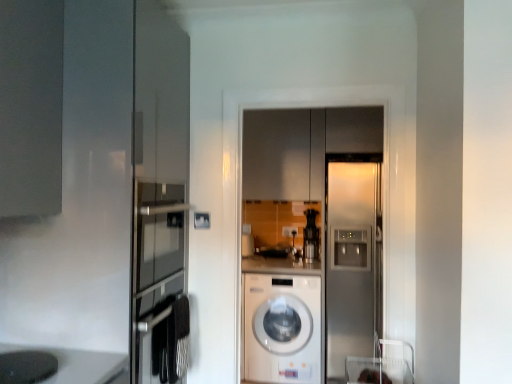
Question: Would you say black plastic coffee machine at center is outside matte gray cabinet at center?

Choices:
 (A) no
 (B) yes

Answer: (B)

Question: Would you say black plastic coffee machine at center contains matte gray cabinet at center?

Choices:
 (A) no
 (B) yes

Answer: (A)

Question: From a real-world perspective, is black plastic coffee machine at center below matte gray cabinet at center?

Choices:
 (A) no
 (B) yes

Answer: (B)

Question: Is black plastic coffee machine at center to the left of matte gray cabinet at center from the viewer's perspective?

Choices:
 (A) yes
 (B) no

Answer: (B)

Question: Considering the relative sizes of black plastic coffee machine at center and matte gray cabinet at center in the image provided, is black plastic coffee machine at center bigger than matte gray cabinet at center?

Choices:
 (A) yes
 (B) no

Answer: (B)

Question: From the image's perspective, is black plastic coffee machine at center on matte gray cabinet at center?

Choices:
 (A) yes
 (B) no

Answer: (B)

Question: Considering the relative positions of matte black coffee maker at lower left and satin silver refrigerator at center in the image provided, is matte black coffee maker at lower left to the left of satin silver refrigerator at center from the viewer's perspective?

Choices:
 (A) no
 (B) yes

Answer: (B)

Question: Would you say matte black coffee maker at lower left is outside satin silver refrigerator at center?

Choices:
 (A) no
 (B) yes

Answer: (B)

Question: Is matte black coffee maker at lower left surrounding satin silver refrigerator at center?

Choices:
 (A) yes
 (B) no

Answer: (B)

Question: Considering the relative sizes of matte black coffee maker at lower left and satin silver refrigerator at center in the image provided, is matte black coffee maker at lower left smaller than satin silver refrigerator at center?

Choices:
 (A) yes
 (B) no

Answer: (A)

Question: Is matte black coffee maker at lower left not near satin silver refrigerator at center?

Choices:
 (A) no
 (B) yes

Answer: (B)

Question: Considering the relative positions of matte black coffee maker at lower left and satin silver refrigerator at center in the image provided, is matte black coffee maker at lower left to the right of satin silver refrigerator at center from the viewer's perspective?

Choices:
 (A) yes
 (B) no

Answer: (B)

Question: From a real-world perspective, is white glossy washing machine at center positioned over black plastic coffee machine at center based on gravity?

Choices:
 (A) no
 (B) yes

Answer: (A)